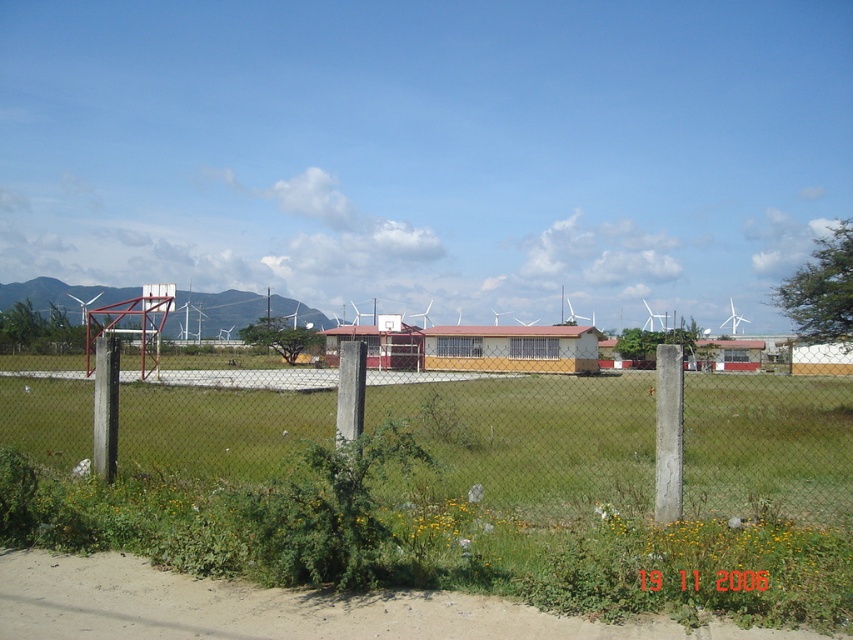
Question: Is metal mesh fence at center wider than metallic red basketball hoop at center?

Choices:
 (A) yes
 (B) no

Answer: (A)

Question: Which point is closer to the camera?

Choices:
 (A) (154, 326)
 (B) (496, 477)

Answer: (B)

Question: Is metal mesh fence at center closer to the viewer compared to metallic red basketball hoop at center?

Choices:
 (A) yes
 (B) no

Answer: (A)

Question: Which point is farther to the camera?

Choices:
 (A) metallic red basketball hoop at center
 (B) metal mesh fence at center

Answer: (A)

Question: Which object appears farthest from the camera in this image?

Choices:
 (A) metallic red basketball hoop at center
 (B) metal mesh fence at center

Answer: (A)

Question: Does metal mesh fence at center have a lesser width compared to metallic red basketball hoop at center?

Choices:
 (A) yes
 (B) no

Answer: (B)